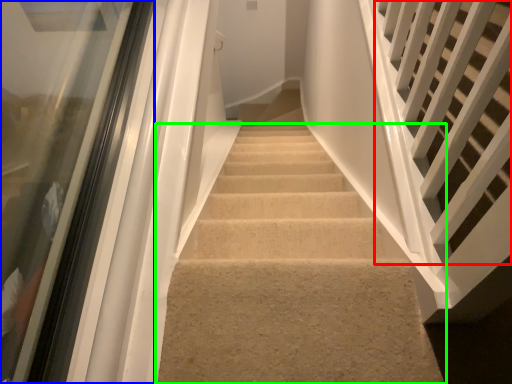
Question: Which object is the closest to the stairs (highlighted by a red box)? Choose among these: glass door (highlighted by a blue box) or stairs (highlighted by a green box).

Choices:
 (A) glass door
 (B) stairs

Answer: (B)